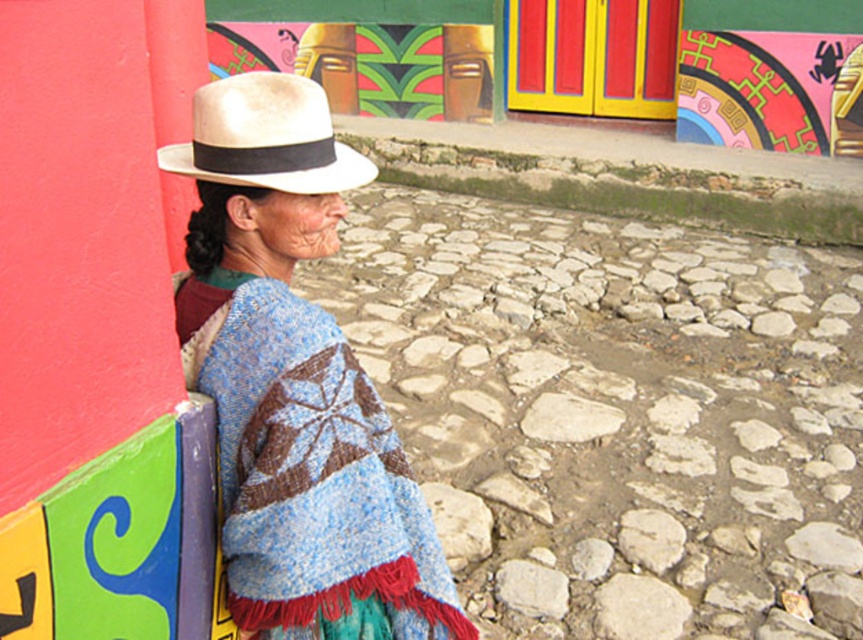
Question: Which object appears farthest from the camera in this image?

Choices:
 (A) knitted wool shawl at left
 (B) white straw fedora at upper left

Answer: (A)

Question: Does knitted wool shawl at left appear under white straw fedora at upper left?

Choices:
 (A) yes
 (B) no

Answer: (A)

Question: Which of the following is the closest to the observer?

Choices:
 (A) (312, 122)
 (B) (417, 529)

Answer: (A)

Question: Is knitted wool shawl at left to the left of white straw fedora at upper left from the viewer's perspective?

Choices:
 (A) yes
 (B) no

Answer: (B)

Question: Where is knitted wool shawl at left located in relation to white straw fedora at upper left in the image?

Choices:
 (A) below
 (B) above

Answer: (A)